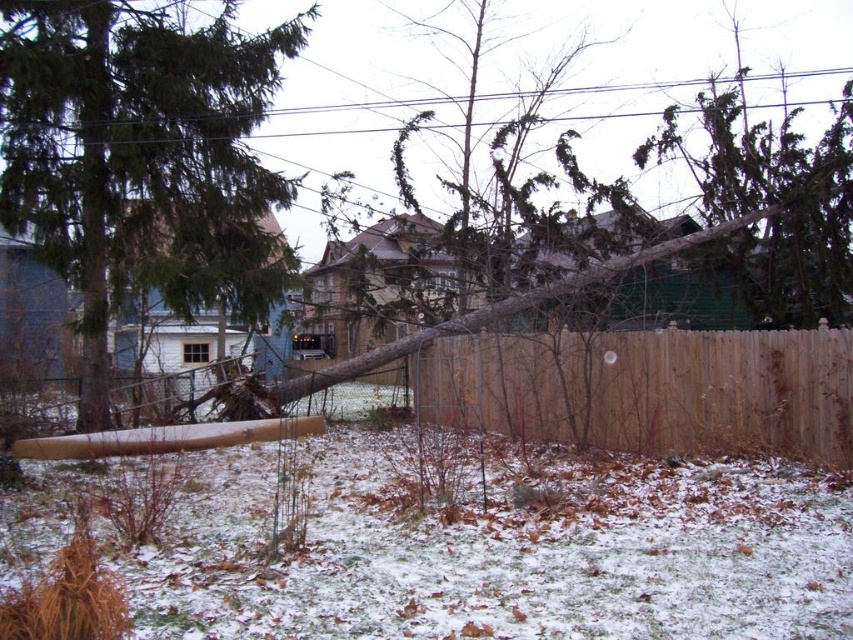
Which of these two, green matte tree at center or brown wood fence at center, stands taller?

green matte tree at center

Does point (209, 24) come farther from viewer compared to point (825, 429)?

Yes.

Where is `green matte tree at center`? Image resolution: width=853 pixels, height=640 pixels. green matte tree at center is located at coordinates (140, 157).